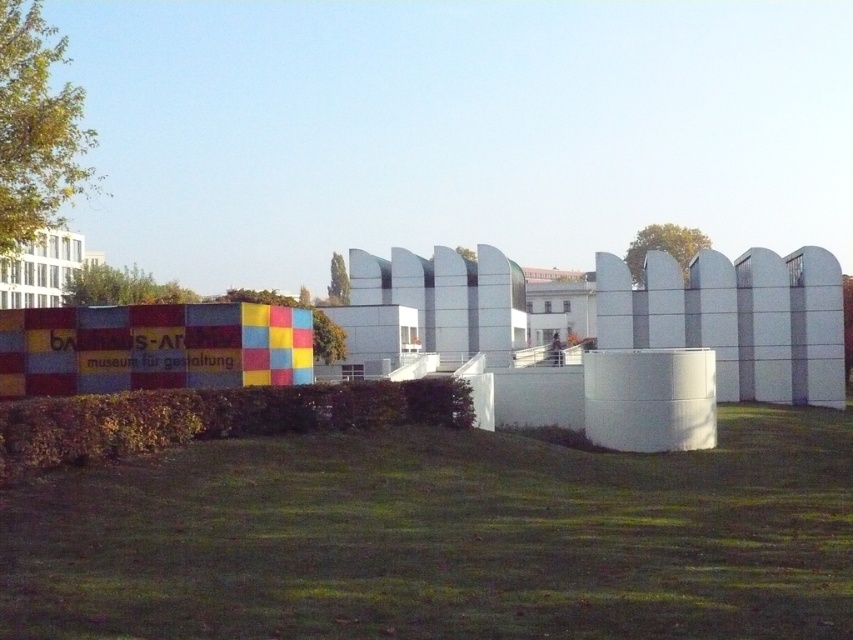
You are standing in front of the Bauhaus Archiv Museum. You see the green grass at lower center and the white smooth fence at center. Which object is closer to you?

The green grass at lower center is closer to you because it is in front of the white smooth fence at center.

You are standing in front of the Bauhaus Archiv Museum for Design and notice green grass at lower center and green leafy hedge at lower center. Which one is closer to you?

The green grass at lower center is closer to you as it is positioned in front of the green leafy hedge at lower center.